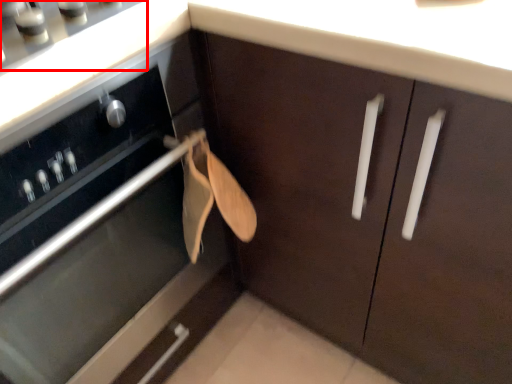
Question: From the image, what is the correct spatial relationship of gas stove (annotated by the red box) in relation to cabinetry?

Choices:
 (A) left
 (B) right

Answer: (B)